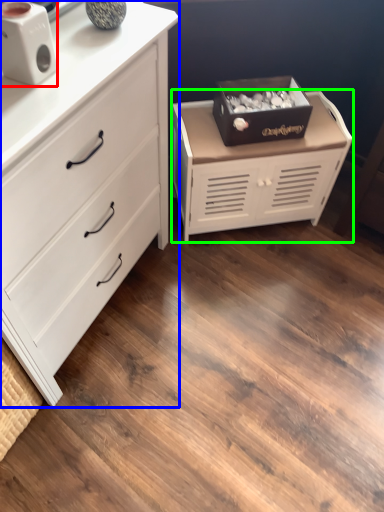
Question: Which is farther away from speaker (highlighted by a red box)? chest of drawers (highlighted by a blue box) or chest of drawers (highlighted by a green box)?

Choices:
 (A) chest of drawers
 (B) chest of drawers

Answer: (B)